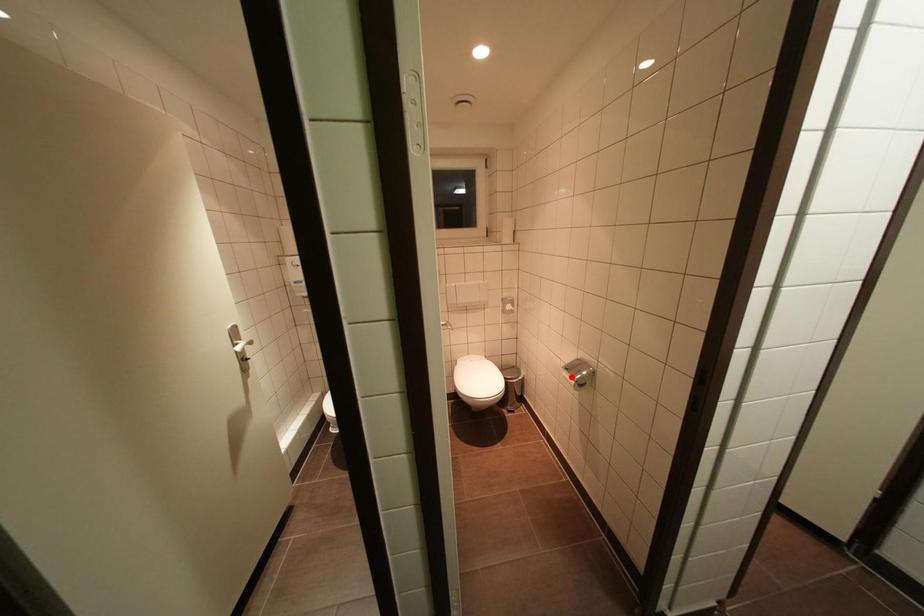
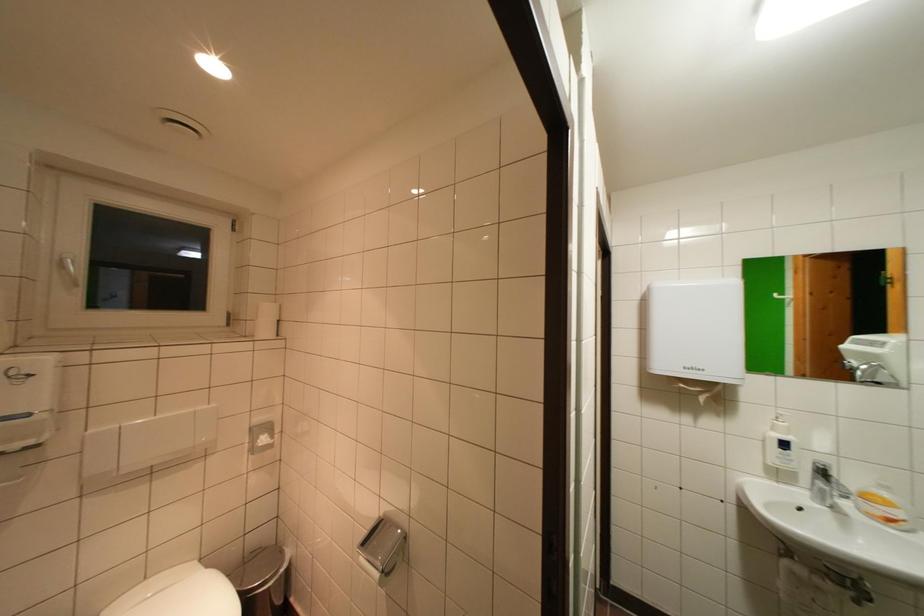
Question: I am providing you with two images of the same scene from different viewpoints. Given a red point in image1, look at the same physical point in image2. Is it:

Choices:
 (A) Closer to the viewpoint
 (B) Farther from the viewpoint

Answer: (B)